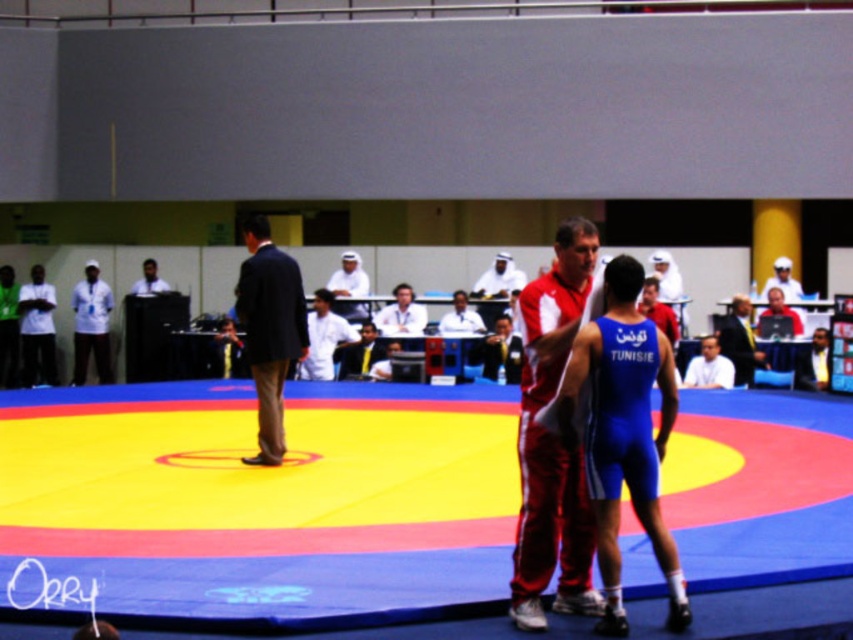
Question: Which object is farther from the camera taking this photo?

Choices:
 (A) blue fabric suit at center
 (B) red track suit at center
 (C) dark suit at center

Answer: (A)

Question: Can you confirm if red track suit at center is bigger than blue fabric suit at center?

Choices:
 (A) yes
 (B) no

Answer: (A)

Question: Does dark suit at center have a larger size compared to blue fabric suit at center?

Choices:
 (A) no
 (B) yes

Answer: (B)

Question: Considering the relative positions of red track suit at center and blue fabric suit at center in the image provided, where is red track suit at center located with respect to blue fabric suit at center?

Choices:
 (A) below
 (B) above

Answer: (A)

Question: Which object appears closest to the camera in this image?

Choices:
 (A) dark suit at center
 (B) red track suit at center
 (C) blue fabric suit at center

Answer: (B)

Question: Which of these objects is positioned farthest from the blue fabric suit at center?

Choices:
 (A) dark suit at center
 (B) red track suit at center

Answer: (B)